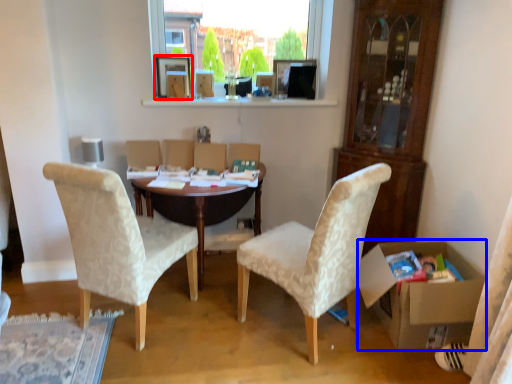
Question: Which of the following is the closest to the observer, picture frame (highlighted by a red box) or box (highlighted by a blue box)?

Choices:
 (A) picture frame
 (B) box

Answer: (B)